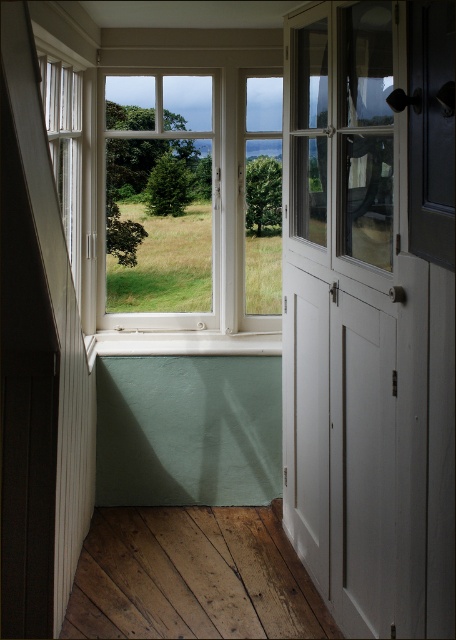
You are a delivery person with a 4.5 feet wide package. You need to carry it through the white wood screen door at right to the white wooden window at center. Can you fit the package through the space between them?

The distance between the white wood screen door at right and the white wooden window at center is 5.07 feet. Since the package is 4.5 feet wide, it can fit through the space between them as the available space is wider than the package.

You are standing in the room and want to exit through the door. Where is the white wood screen door at right located relative to the window?

The white wood screen door at right is located at point (352, 321) relative to the window.